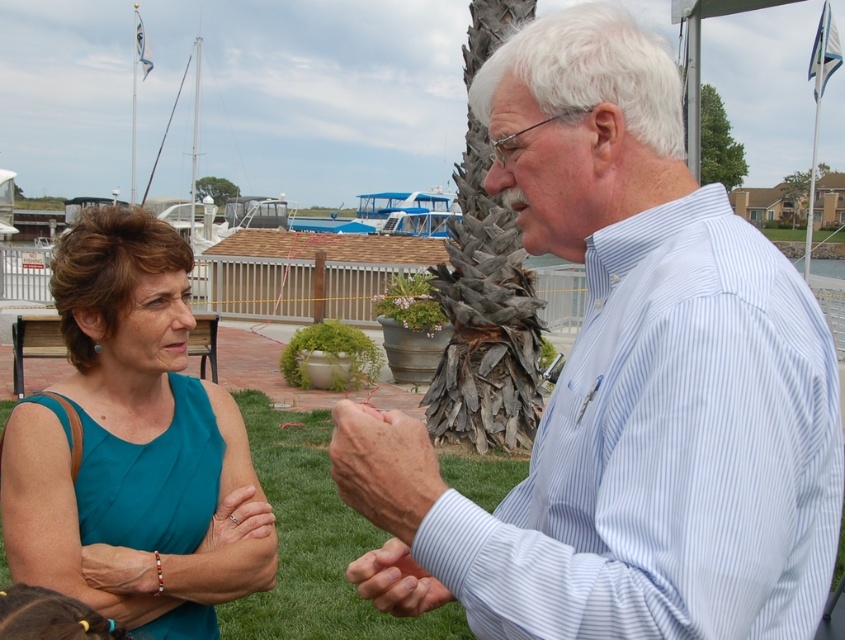
What is the color of the clothing item located at the coordinates point (646, 376)?

The point (646, 376) indicates blue striped shirt at center, so the clothing item there is blue striped.

You are a photographer trying to capture a closeup of the blue striped shirt at center and the dry skin at center in the scene. Since you can only focus on one object at a time, which one should you choose to ensure it appears sharp and in focus?

The blue striped shirt at center is closer to the viewer than dry skin at center, so you should focus on the blue striped shirt at center to ensure it appears sharp.

You are a photographer trying to capture a candid shot of the two people in the scene. The blue striped shirt at center and the teal fabric dress at left are both in your viewfinder. Based on their positions, which clothing item is positioned higher in the frame?

The blue striped shirt at center is above the teal fabric dress at left, so it is positioned higher in the frame.